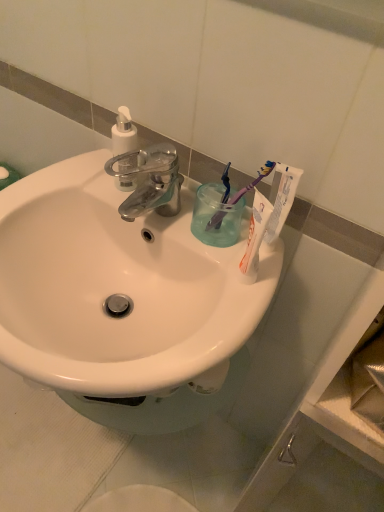
Measure the distance between point [208,234] and camera.

The distance of point [208,234] from camera is 31.85 inches.

The width and height of the screenshot is (384, 512). What do you see at coordinates (238, 196) in the screenshot?
I see `purple plastic toothbrush at upper right, which is the second toothbrush in left-to-right order` at bounding box center [238, 196].

You are a GUI agent. You are given a task and a screenshot of the screen. Output one action in this format:
    pyautogui.click(x=<x>, y=<y>)
    Task: Click on the purple plastic toothbrush at upper right, which is the first toothbrush from right to left
    The height and width of the screenshot is (512, 384).
    Given the screenshot: What is the action you would take?
    pyautogui.click(x=238, y=196)

What do you see at coordinates (117, 287) in the screenshot? The height and width of the screenshot is (512, 384). I see `white glossy sink at center` at bounding box center [117, 287].

How much space does blue plastic toothbrush at upper right, the second toothbrush positioned from the right, occupy vertically?

5.89 inches.

You are a GUI agent. You are given a task and a screenshot of the screen. Output one action in this format:
    pyautogui.click(x=<x>, y=<y>)
    Task: Click on the white matte toothpaste at upper right
    The height and width of the screenshot is (512, 384).
    Given the screenshot: What is the action you would take?
    pyautogui.click(x=281, y=198)

Identify the location of transparent plastic cup at upper right. (215, 216).

Who is more distant, white matte toothpaste at upper right or white plastic soap dispenser at upper left?

white plastic soap dispenser at upper left.

Does point (266, 241) come farther from viewer compared to point (125, 162)?

No, (266, 241) is in front of (125, 162).

Is white matte toothpaste at upper right completely or partially outside of white plastic soap dispenser at upper left?

Yes.

Does white matte toothpaste at upper right have a greater width compared to white plastic soap dispenser at upper left?

In fact, white matte toothpaste at upper right might be narrower than white plastic soap dispenser at upper left.

Is purple plastic toothbrush at upper right, which is the first toothbrush from right to left, positioned before white glossy sink at center?

No, the depth of purple plastic toothbrush at upper right, which is the first toothbrush from right to left, is greater than that of white glossy sink at center.

Where is `the 2nd toothbrush to the right of the white glossy sink at center, starting your count from the anchor`? This screenshot has width=384, height=512. the 2nd toothbrush to the right of the white glossy sink at center, starting your count from the anchor is located at coordinates (238, 196).

Is purple plastic toothbrush at upper right, which is the first toothbrush from right to left, looking in the opposite direction of white glossy sink at center?

No, purple plastic toothbrush at upper right, which is the first toothbrush from right to left,'s orientation is not away from white glossy sink at center.

Is purple plastic toothbrush at upper right, which is the second toothbrush in left-to-right order, not within white glossy sink at center?

Yes, purple plastic toothbrush at upper right, which is the second toothbrush in left-to-right order, is not within white glossy sink at center.

Does white glossy sink at center touch white matte toothpaste at upper right?

No.

How much distance is there between white glossy sink at center and white matte toothpaste at upper right?

white glossy sink at center and white matte toothpaste at upper right are 11.60 inches apart.

From the image's perspective, which is below, white glossy sink at center or white matte toothpaste at upper right?

white glossy sink at center, from the image's perspective.

Would you say white glossy sink at center is inside or outside white matte toothpaste at upper right?

white glossy sink at center is not enclosed by white matte toothpaste at upper right.

Considering the points (210, 224) and (282, 172), which point is behind, point (210, 224) or point (282, 172)?

The point (210, 224) is farther from the camera.

Can you confirm if blue plastic toothbrush at upper right, the first toothbrush when ordered from left to right, is wider than white matte toothpaste at upper right?

Yes, blue plastic toothbrush at upper right, the first toothbrush when ordered from left to right, is wider than white matte toothpaste at upper right.

Considering the relative positions of blue plastic toothbrush at upper right, the first toothbrush when ordered from left to right, and white matte toothpaste at upper right in the image provided, is blue plastic toothbrush at upper right, the first toothbrush when ordered from left to right, to the left of white matte toothpaste at upper right from the viewer's perspective?

Correct, you'll find blue plastic toothbrush at upper right, the first toothbrush when ordered from left to right, to the left of white matte toothpaste at upper right.

In the image, is transparent plastic cup at upper right on the left side or the right side of white matte toothpaste at upper right?

A: transparent plastic cup at upper right is positioned on white matte toothpaste at upper right's left side.

Is point (208, 219) positioned after point (266, 231)?

Yes.

From a real-world perspective, between transparent plastic cup at upper right and white matte toothpaste at upper right, who is vertically lower?

From a 3D spatial view, transparent plastic cup at upper right is below.

How different are the orientations of transparent plastic cup at upper right and white matte toothpaste at upper right in degrees?

They differ by 0.000474 degrees in their facing directions.

From the image's perspective, is white matte toothpaste at upper right below transparent plastic cup at upper right?

Actually, white matte toothpaste at upper right appears above transparent plastic cup at upper right in the image.

In the scene shown: Is white matte toothpaste at upper right inside the boundaries of transparent plastic cup at upper right, or outside?

white matte toothpaste at upper right is located beyond the bounds of transparent plastic cup at upper right.

This screenshot has width=384, height=512. What are the coordinates of `toothpaste located on the right of transparent plastic cup at upper right` in the screenshot? It's located at (281, 198).

Is white matte toothpaste at upper right turned away from transparent plastic cup at upper right?

No.

From a real-world perspective, is blue plastic toothbrush at upper right, the first toothbrush when ordered from left to right, under white glossy sink at center?

No, from a real-world perspective, blue plastic toothbrush at upper right, the first toothbrush when ordered from left to right, is not beneath white glossy sink at center.

Are blue plastic toothbrush at upper right, the second toothbrush positioned from the right, and white glossy sink at center beside each other?

No, blue plastic toothbrush at upper right, the second toothbrush positioned from the right, is not touching white glossy sink at center.

This screenshot has height=512, width=384. Find the location of `sink located underneath the blue plastic toothbrush at upper right, the second toothbrush positioned from the right (from a real-world perspective)`. sink located underneath the blue plastic toothbrush at upper right, the second toothbrush positioned from the right (from a real-world perspective) is located at coordinates (117, 287).

Locate an element on the screen. The image size is (384, 512). toothpaste on the right side of white plastic soap dispenser at upper left is located at coordinates (281, 198).

Where is `sink on the left of purple plastic toothbrush at upper right, which is the second toothbrush in left-to-right order`? sink on the left of purple plastic toothbrush at upper right, which is the second toothbrush in left-to-right order is located at coordinates (117, 287).

Estimate the real-world distances between objects in this image. Which object is closer to white plastic soap dispenser at upper left, transparent plastic cup at upper right or purple plastic toothbrush at upper right, which is the first toothbrush from right to left?

transparent plastic cup at upper right lies closer to white plastic soap dispenser at upper left than the other object.

In the scene shown: From the image, which object appears to be farther from purple plastic toothbrush at upper right, which is the first toothbrush from right to left, blue plastic toothbrush at upper right, the second toothbrush positioned from the right, or white plastic soap dispenser at upper left?

Among the two, white plastic soap dispenser at upper left is located further to purple plastic toothbrush at upper right, which is the first toothbrush from right to left.

When comparing their distances from purple plastic toothbrush at upper right, which is the second toothbrush in left-to-right order, does transparent plastic cup at upper right or blue plastic toothbrush at upper right, the second toothbrush positioned from the right, seem further?

Among the two, transparent plastic cup at upper right is located further to purple plastic toothbrush at upper right, which is the second toothbrush in left-to-right order.

Based on their spatial positions, is white matte toothpaste at upper right or blue plastic toothbrush at upper right, the first toothbrush when ordered from left to right, further from white plastic soap dispenser at upper left?

white matte toothpaste at upper right is further to white plastic soap dispenser at upper left.

Looking at the image, which one is located further to purple plastic toothbrush at upper right, which is the first toothbrush from right to left, blue plastic toothbrush at upper right, the first toothbrush when ordered from left to right, or white glossy sink at center?

The object further to purple plastic toothbrush at upper right, which is the first toothbrush from right to left, is white glossy sink at center.

Considering their positions, is blue plastic toothbrush at upper right, the first toothbrush when ordered from left to right, positioned further to white plastic soap dispenser at upper left than transparent plastic cup at upper right?

blue plastic toothbrush at upper right, the first toothbrush when ordered from left to right, lies further to white plastic soap dispenser at upper left than the other object.

Which object lies further to the anchor point transparent plastic cup at upper right, white matte toothpaste at upper right or white glossy sink at center?

The object further to transparent plastic cup at upper right is white glossy sink at center.

Based on their spatial positions, is purple plastic toothbrush at upper right, which is the second toothbrush in left-to-right order, or white glossy sink at center closer to white plastic soap dispenser at upper left?

Among the two, white glossy sink at center is located nearer to white plastic soap dispenser at upper left.

Where is `toiletry between white glossy sink at center and white matte toothpaste at upper right in the horizontal direction`? toiletry between white glossy sink at center and white matte toothpaste at upper right in the horizontal direction is located at coordinates (123, 132).

Locate an element on the screen. The image size is (384, 512). liquid located between white glossy sink at center and purple plastic toothbrush at upper right, which is the second toothbrush in left-to-right order, in the left-right direction is located at coordinates (215, 216).

This screenshot has height=512, width=384. In order to click on liquid located between white glossy sink at center and white matte toothpaste at upper right in the left-right direction in this screenshot , I will do `click(215, 216)`.

Identify the location of toothbrush between white glossy sink at center and purple plastic toothbrush at upper right, which is the second toothbrush in left-to-right order, in the horizontal direction. This screenshot has width=384, height=512. (x=226, y=184).